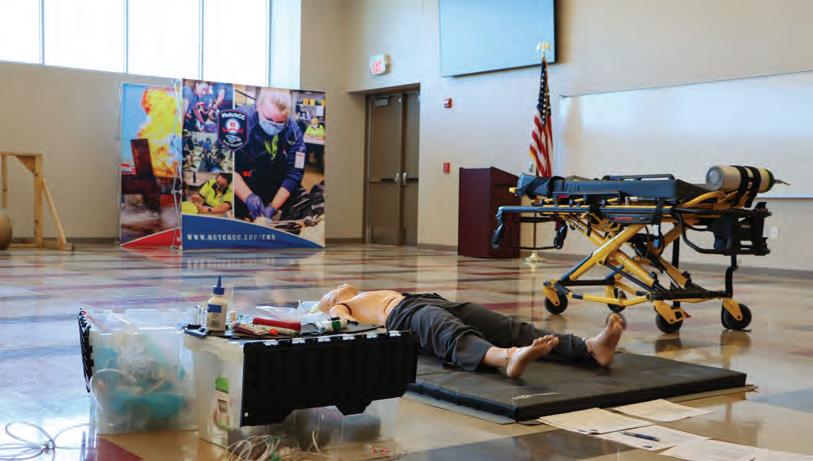
This screenshot has width=813, height=461. Identify the location of bin. (163, 384).